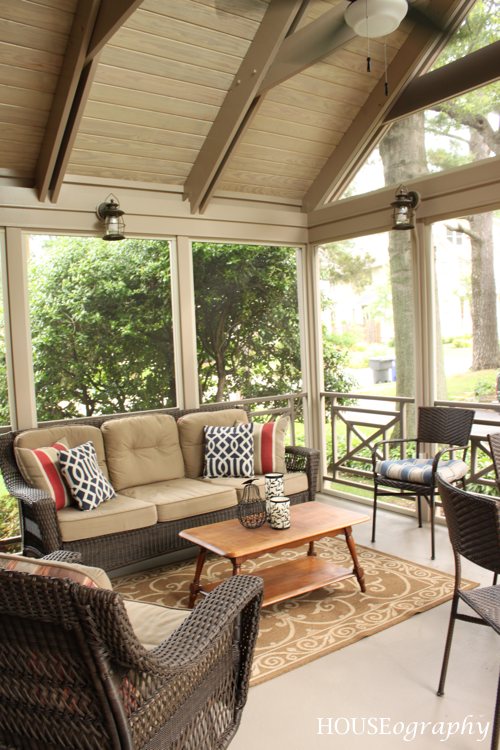
Locate an element on the screen. This screenshot has height=750, width=500. sunroom is located at coordinates (333, 681).